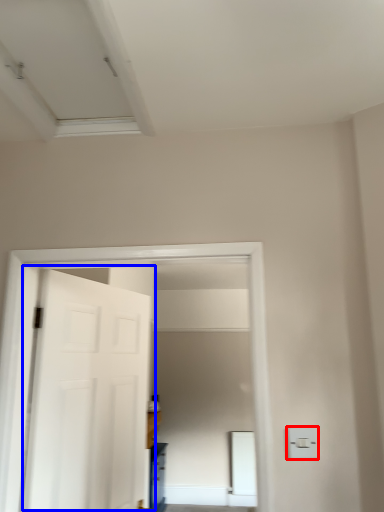
Question: Which object is closer to the camera taking this photo, light switch (highlighted by a red box) or door (highlighted by a blue box)?

Choices:
 (A) light switch
 (B) door

Answer: (A)